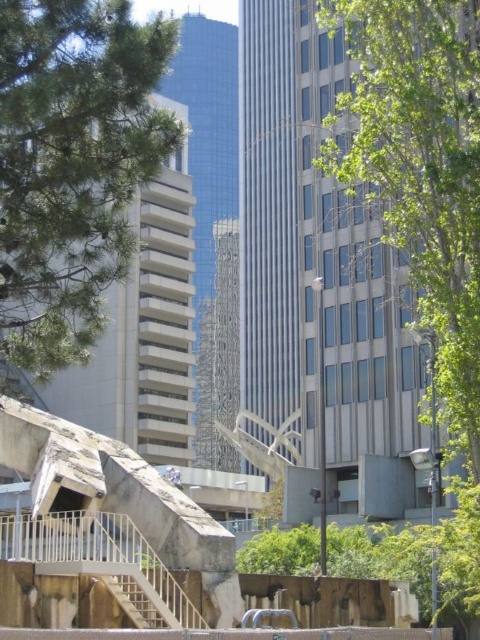
Question: Which point appears closest to the camera in this image?

Choices:
 (A) (131, 236)
 (B) (113, 577)

Answer: (B)

Question: Is green leafy tree at left below brown wooden stairs at lower left?

Choices:
 (A) no
 (B) yes

Answer: (A)

Question: Can you confirm if green leafy tree at center is positioned to the left of brown wooden stairs at lower left?

Choices:
 (A) no
 (B) yes

Answer: (A)

Question: Does green leafy tree at center have a larger size compared to brown wooden stairs at lower left?

Choices:
 (A) yes
 (B) no

Answer: (A)

Question: Among these points, which one is nearest to the camera?

Choices:
 (A) (343, 352)
 (B) (127, 609)
 (C) (33, 349)

Answer: (B)

Question: Which object appears closest to the camera in this image?

Choices:
 (A) green leafy tree at center
 (B) green leafy tree at left

Answer: (B)